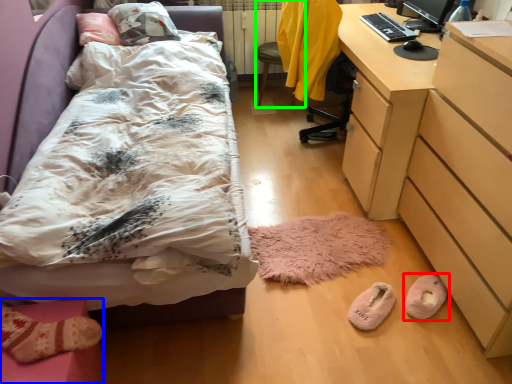
Question: Which is nearer to the footwear (highlighted by a red box)? furniture (highlighted by a blue box) or swivel chair (highlighted by a green box).

Choices:
 (A) furniture
 (B) swivel chair

Answer: (A)